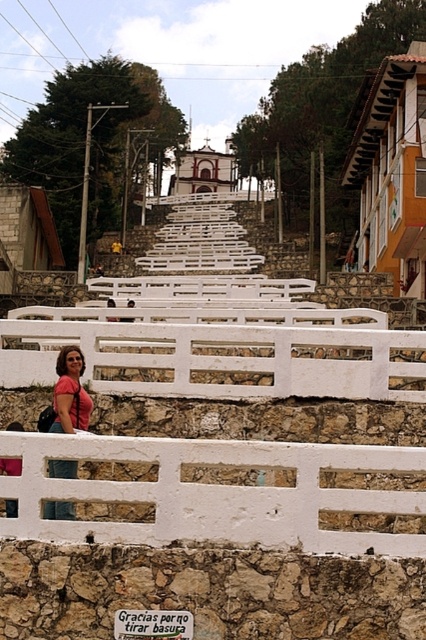
Is white painted wood fence at lower center further to the viewer compared to pink fabric bag at lower left?

Yes.

Which of these two, white painted wood fence at lower center or pink fabric bag at lower left, stands shorter?

With less height is pink fabric bag at lower left.

This screenshot has height=640, width=426. I want to click on white painted wood fence at lower center, so click(221, 358).

Is point (259, 468) farther from camera compared to point (63, 364)?

No, it is not.

Between point (0, 536) and point (71, 355), which one is positioned in front?

Point (0, 536) is in front.

Identify the location of white stone fence at lower center. (213, 492).

Based on the photo, can you confirm if white stone fence at lower center is smaller than white painted wood fence at lower center?

Yes, white stone fence at lower center is smaller than white painted wood fence at lower center.

Is white stone fence at lower center taller than white painted wood fence at lower center?

Indeed, white stone fence at lower center has a greater height compared to white painted wood fence at lower center.

Which is behind, point (108, 499) or point (86, 349)?

The point (86, 349) is more distant.

I want to click on white stone fence at lower center, so click(x=213, y=492).